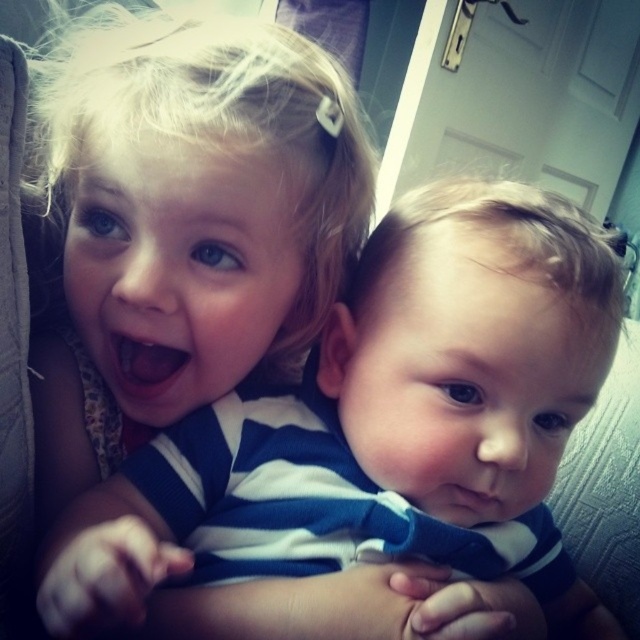
Question: Which of the following is the farthest from the observer?

Choices:
 (A) bright pink flesh at center
 (B) blue striped shirt at center

Answer: (A)

Question: Does blue striped shirt at center appear under blonde hair at upper left?

Choices:
 (A) no
 (B) yes

Answer: (B)

Question: Based on their relative distances, which object is nearer to the blue striped shirt at center?

Choices:
 (A) blonde hair at upper left
 (B) bright pink flesh at center

Answer: (A)

Question: Which object is positioned closest to the blonde hair at upper left?

Choices:
 (A) blue striped shirt at center
 (B) bright pink flesh at center

Answer: (B)

Question: Is blue striped shirt at center to the left of blonde hair at upper left from the viewer's perspective?

Choices:
 (A) yes
 (B) no

Answer: (B)

Question: Is blue striped shirt at center smaller than blonde hair at upper left?

Choices:
 (A) no
 (B) yes

Answer: (A)